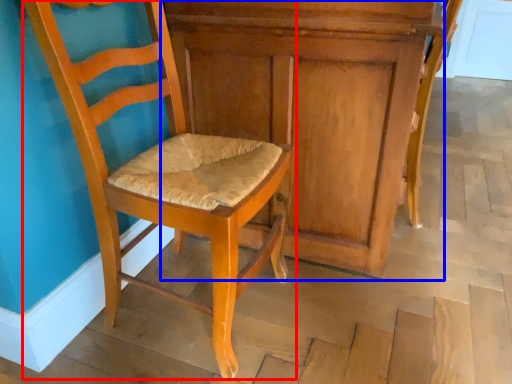
Question: Which object is closer to the camera taking this photo, chair (highlighted by a red box) or dresser (highlighted by a blue box)?

Choices:
 (A) chair
 (B) dresser

Answer: (A)